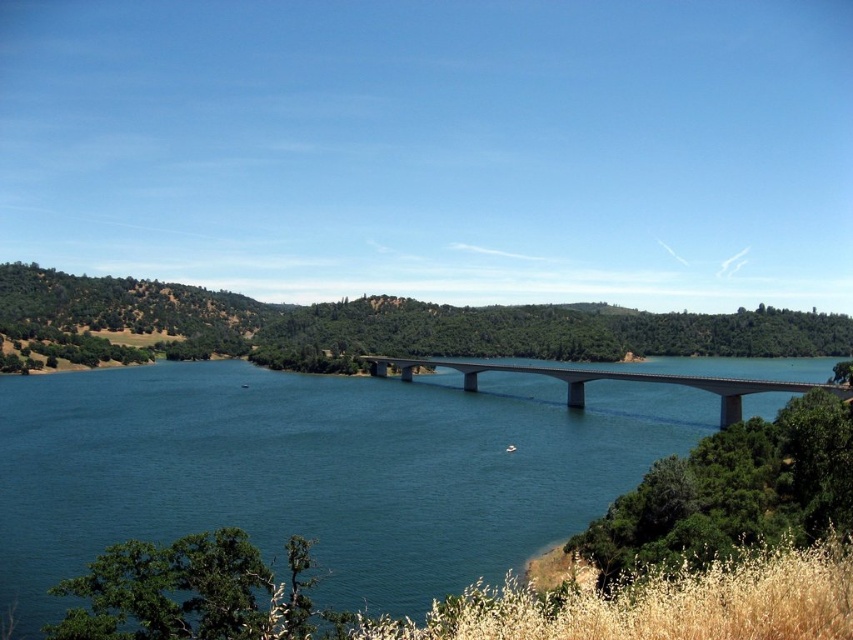
Does point (686, 368) come in front of point (271, 337)?

Yes, point (686, 368) is closer to viewer.

Between blue smooth water at center and green leafy hillside at center, which one appears on the right side from the viewer's perspective?

Positioned to the right is blue smooth water at center.

Which is behind, point (154, 406) or point (212, 324)?

The point (212, 324) is behind.

Locate an element on the screen. Image resolution: width=853 pixels, height=640 pixels. blue smooth water at center is located at coordinates (318, 470).

Can you confirm if green leafy hillside at center is positioned below concrete bridge at center?

No, green leafy hillside at center is not below concrete bridge at center.

Which is in front, point (67, 298) or point (474, 376)?

Point (474, 376) is in front.

Locate an element on the screen. The image size is (853, 640). green leafy hillside at center is located at coordinates (393, 324).

Is blue smooth water at center wider than concrete bridge at center?

Yes, blue smooth water at center is wider than concrete bridge at center.

Is blue smooth water at center above concrete bridge at center?

No.

Describe the element at coordinates (318, 470) in the screenshot. Image resolution: width=853 pixels, height=640 pixels. I see `blue smooth water at center` at that location.

The height and width of the screenshot is (640, 853). What are the coordinates of `blue smooth water at center` in the screenshot? It's located at (318, 470).